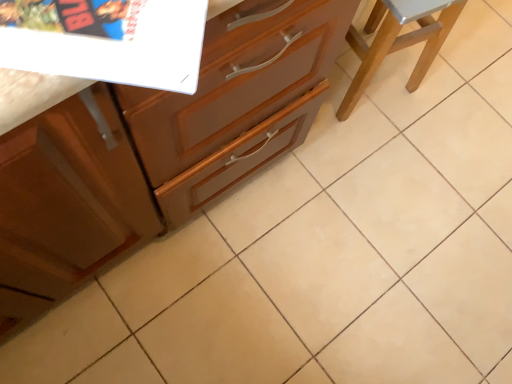
The image size is (512, 384). I want to click on vacant space to the right of wooden stool at right, so click(442, 103).